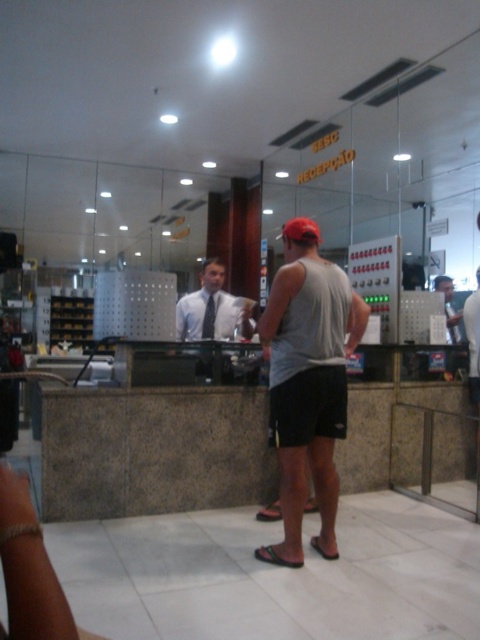
Consider the image. Can you confirm if matte white shirt at center is positioned above matte gray shirt at center?

No, matte white shirt at center is not above matte gray shirt at center.

Is matte white shirt at center thinner than matte gray shirt at center?

Yes.

Locate an element on the screen. This screenshot has width=480, height=640. matte white shirt at center is located at coordinates [x=208, y=308].

Is gray fabric tank top at center to the left of matte gray shirt at center from the viewer's perspective?

Yes, gray fabric tank top at center is to the left of matte gray shirt at center.

Can you confirm if gray fabric tank top at center is bigger than matte gray shirt at center?

No, gray fabric tank top at center is not bigger than matte gray shirt at center.

Does point (477, 454) come in front of point (436, 276)?

That is True.

Where is `gray fabric tank top at center`? gray fabric tank top at center is located at coordinates (474, 349).

Is matte white shirt at center below gray fabric tank top at center?

Actually, matte white shirt at center is above gray fabric tank top at center.

Is matte white shirt at center taller than gray fabric tank top at center?

No.

In the scene shown: Who is more forward, (216, 328) or (477, 374)?

Point (477, 374) is more forward.

Locate an element on the screen. matte white shirt at center is located at coordinates (208, 308).